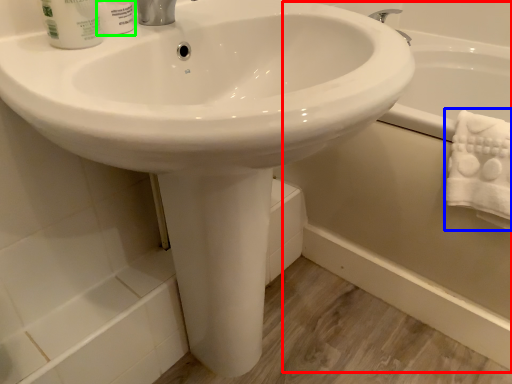
Question: Which object is positioned closest to bath (highlighted by a red box)? Select from bath towel (highlighted by a blue box) and shaving cream (highlighted by a green box).

Choices:
 (A) bath towel
 (B) shaving cream

Answer: (A)